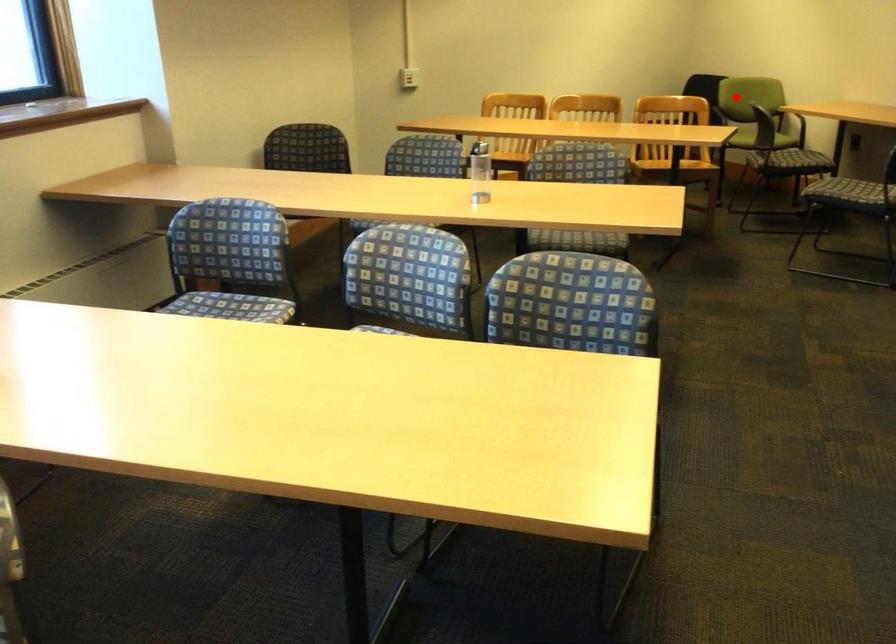
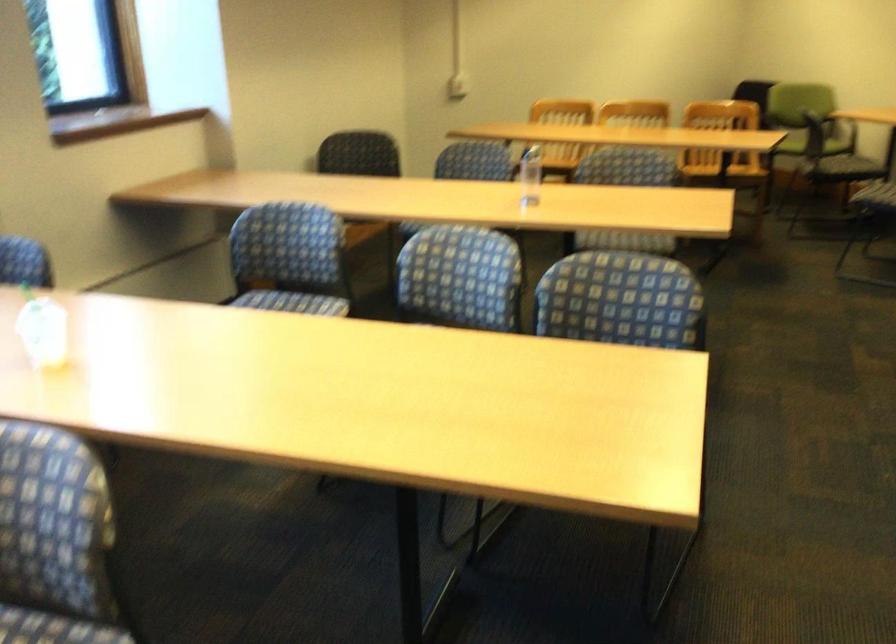
Find the pixel in the second image that matches the highlighted location in the first image.

(786, 100)